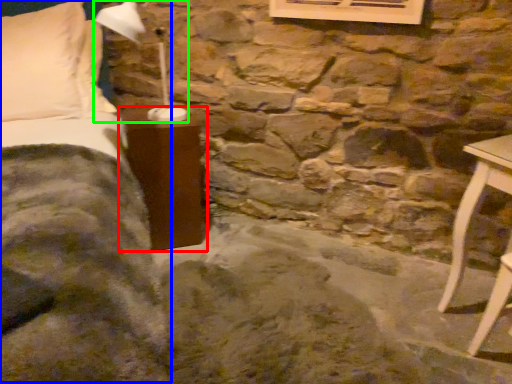
Question: Which object is positioned closest to furniture (highlighted by a red box)? Select from bed (highlighted by a blue box) and table lamp (highlighted by a green box).

Choices:
 (A) bed
 (B) table lamp

Answer: (A)